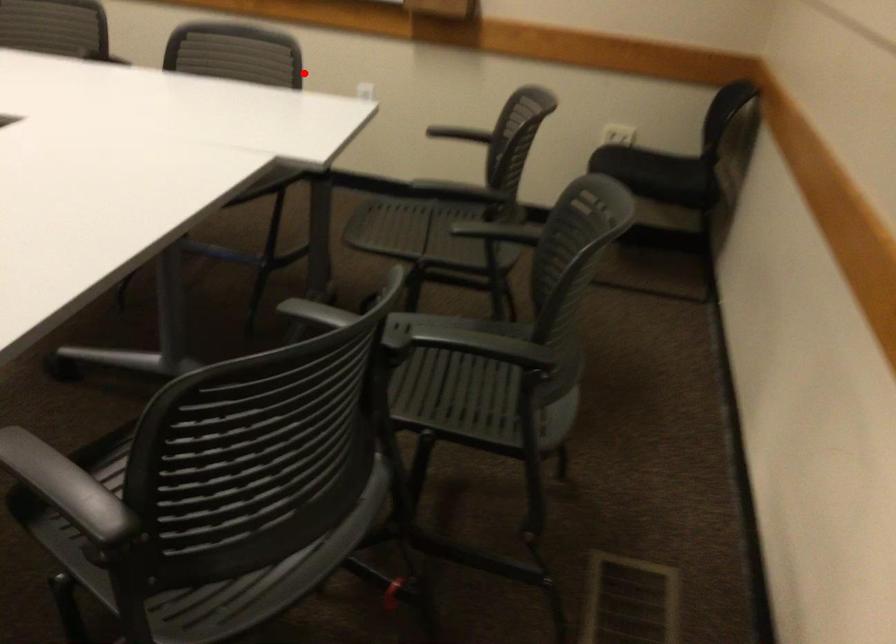
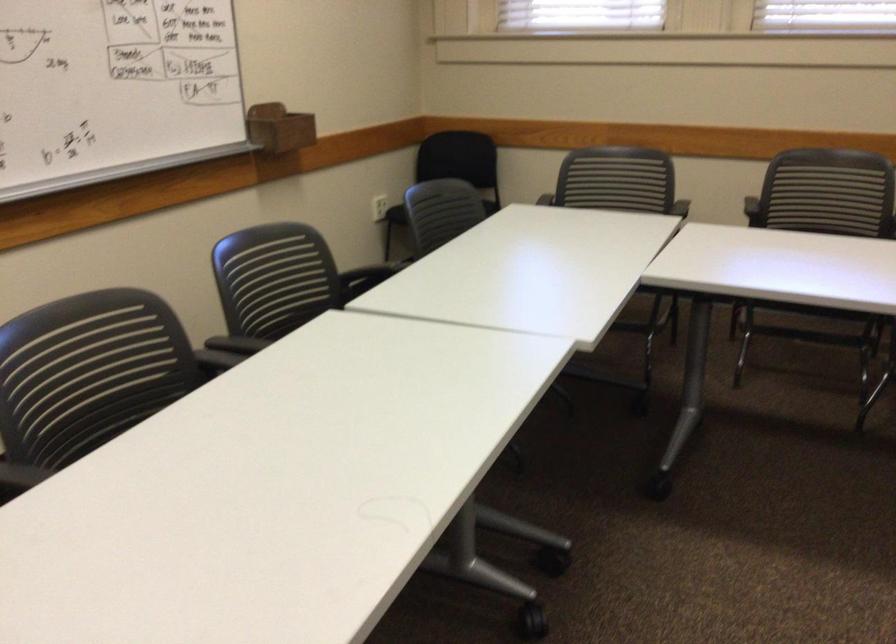
Locate, in the second image, the point that corresponds to the highlighted location in the first image.

(441, 212)